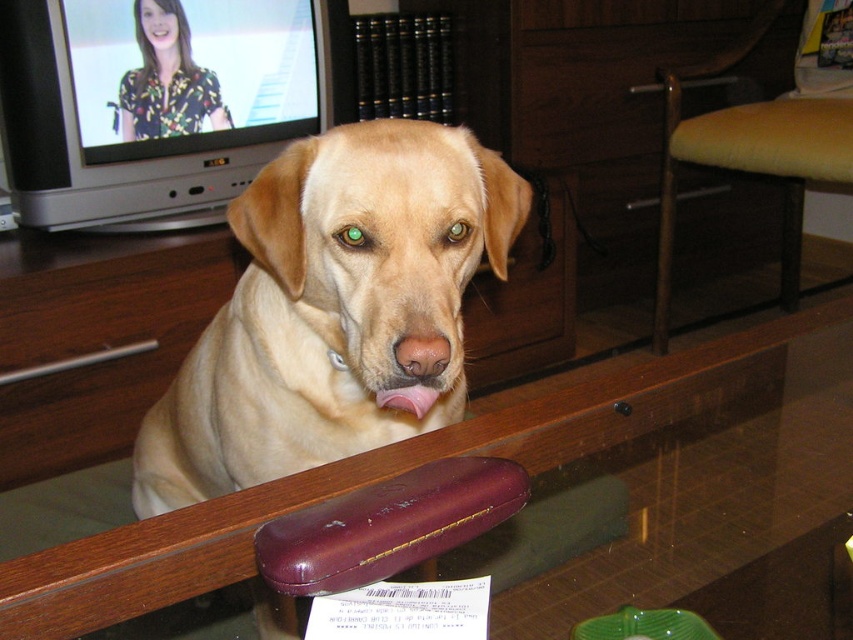
Is light brown fur at center smaller than transparent glass table at center?

Yes, light brown fur at center is smaller than transparent glass table at center.

Is light brown fur at center to the right of transparent glass table at center from the viewer's perspective?

In fact, light brown fur at center is to the left of transparent glass table at center.

Between point (469, 138) and point (62, 577), which one is positioned behind?

Positioned behind is point (469, 138).

The image size is (853, 640). Find the location of `light brown fur at center`. light brown fur at center is located at coordinates (334, 310).